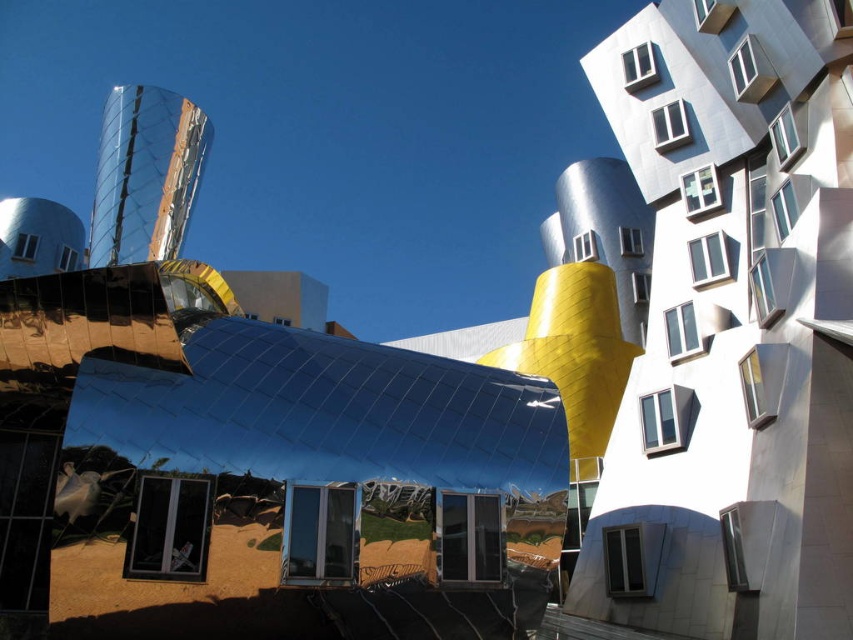
Based on the photo, does metallic silver building at center have a lesser width compared to matte glass window at center?

No, metallic silver building at center is not thinner than matte glass window at center.

Which is in front, point (630, 624) or point (154, 547)?

Point (154, 547) is in front.

The height and width of the screenshot is (640, 853). Identify the location of metallic silver building at center. (732, 324).